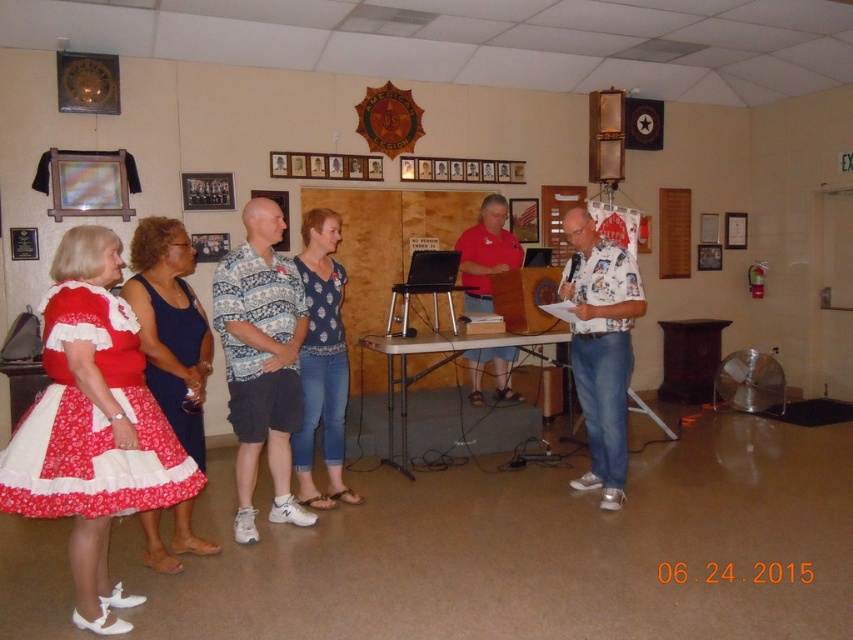
Question: Which point is farther to the camera?

Choices:
 (A) (242, 316)
 (B) (480, 374)
 (C) (596, 422)

Answer: (B)

Question: Is blue satin dress at left smaller than blue printed blouse at center?

Choices:
 (A) no
 (B) yes

Answer: (B)

Question: Estimate the real-world distances between objects in this image. Which object is closer to the red floral fabric dress at lower left?

Choices:
 (A) white printed shirt at center
 (B) red cotton dress at left
 (C) blue satin dress at left
 (D) patterned fabric shirt at center

Answer: (C)

Question: Which of the following is the closest to the observer?

Choices:
 (A) (613, 508)
 (B) (117, 300)
 (C) (498, 259)
 (D) (310, 444)

Answer: (B)

Question: Does white printed shirt at center have a greater width compared to blue printed blouse at center?

Choices:
 (A) yes
 (B) no

Answer: (A)

Question: Does white printed shirt at center have a smaller size compared to matte pink shirt at center?

Choices:
 (A) yes
 (B) no

Answer: (B)